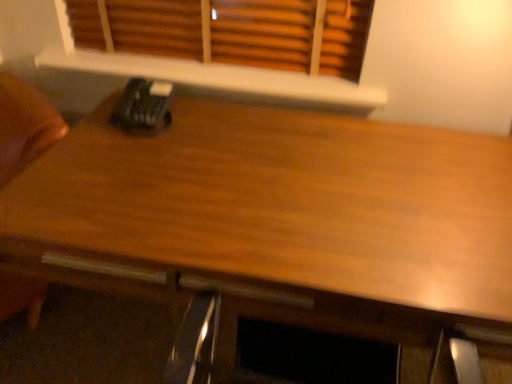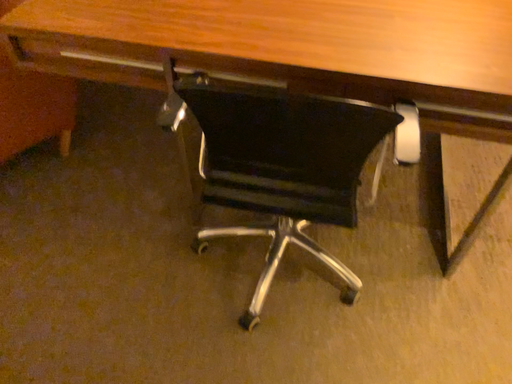
Question: How did the camera likely rotate when shooting the video?

Choices:
 (A) rotated upward
 (B) rotated downward

Answer: (B)